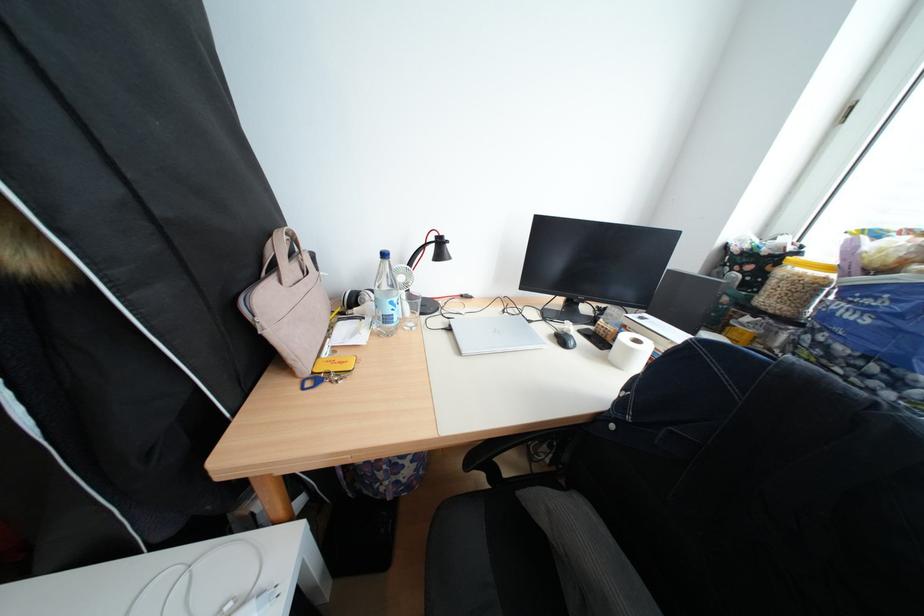
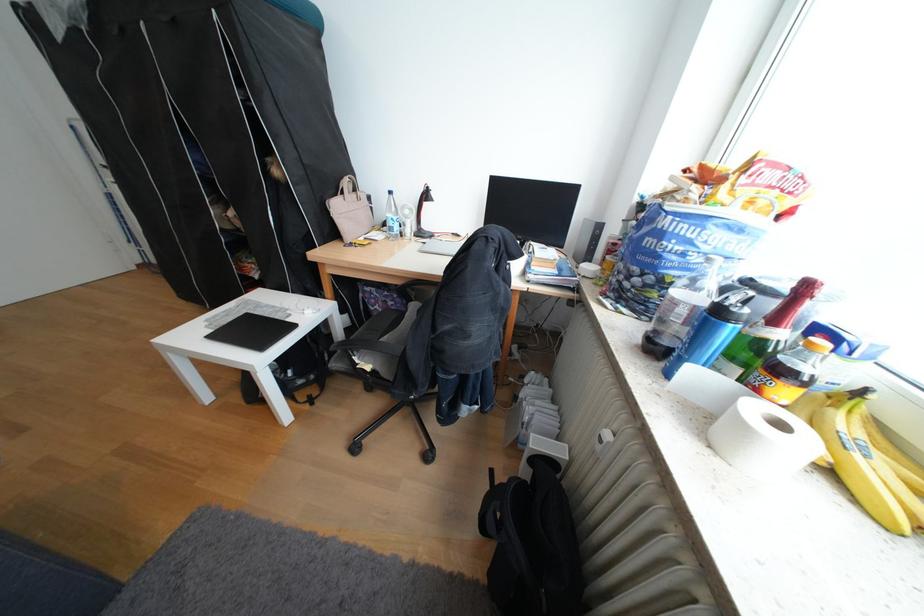
In the second image, find the point that corresponds to (x=550, y=217) in the first image.

(504, 177)